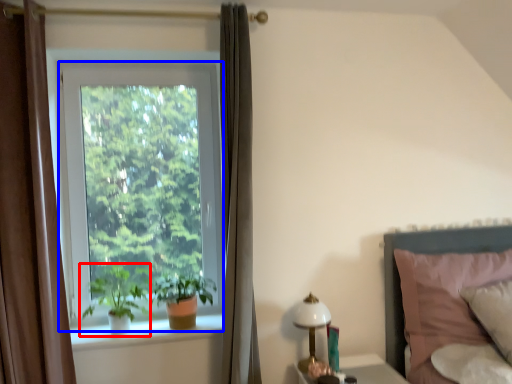
Question: Among these objects, which one is farthest to the camera, houseplant (highlighted by a red box) or window (highlighted by a blue box)?

Choices:
 (A) houseplant
 (B) window

Answer: (B)